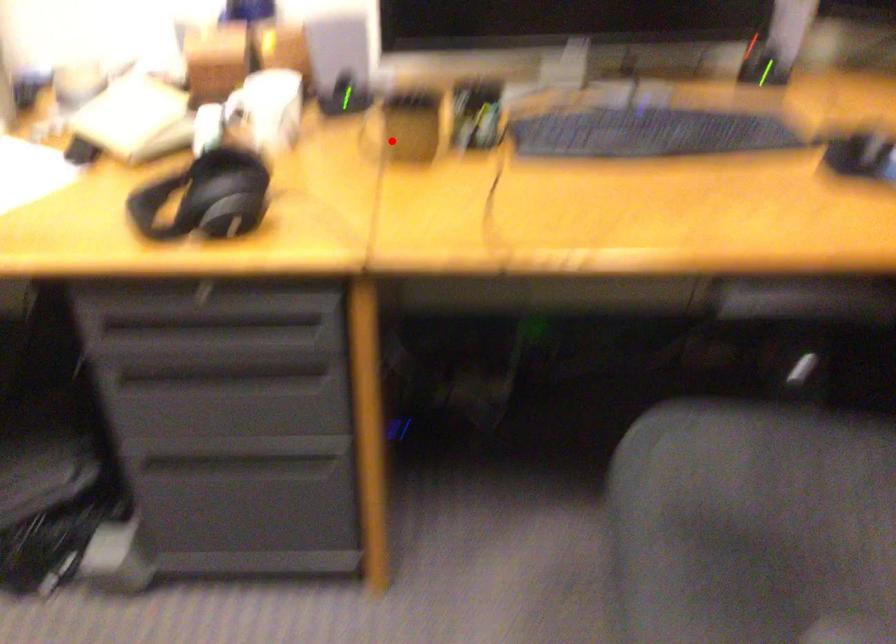
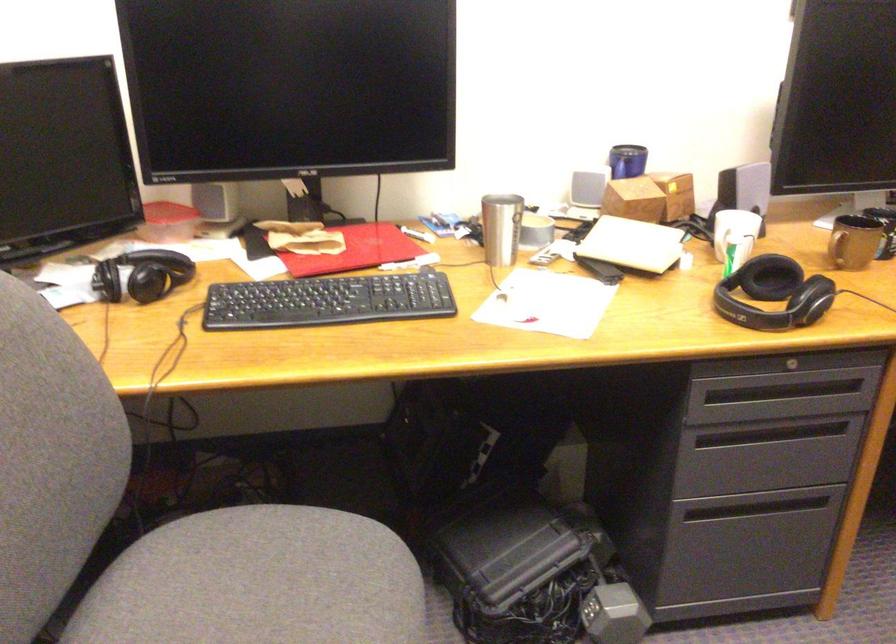
The point at the highlighted location is marked in the first image. Where is the corresponding point in the second image?

(854, 242)